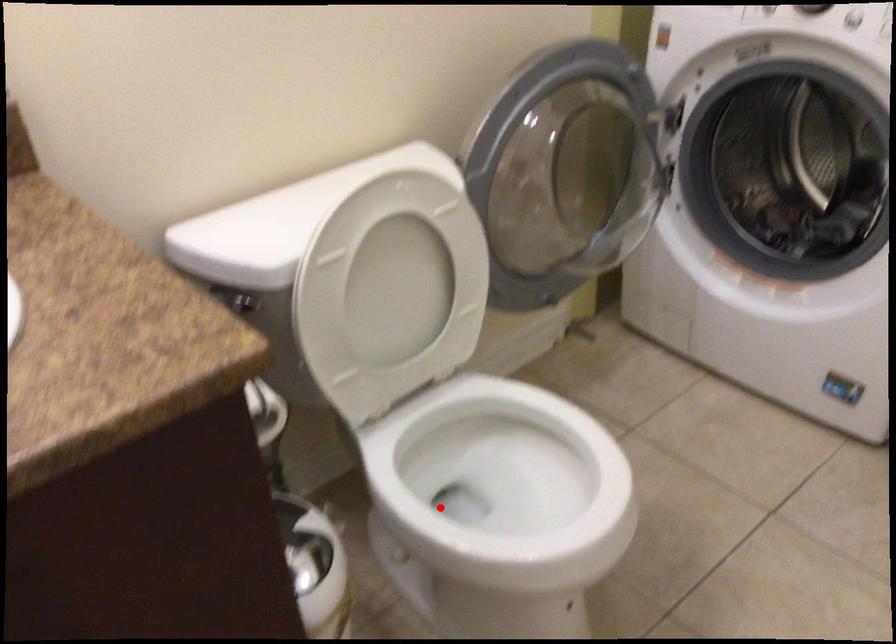
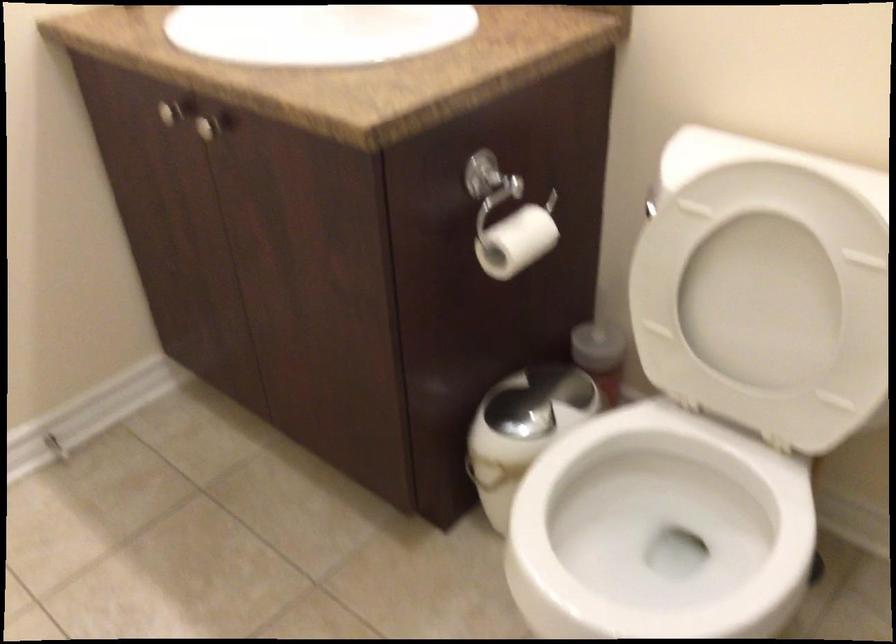
Find the pixel in the second image that matches the highlighted location in the first image.

(660, 524)